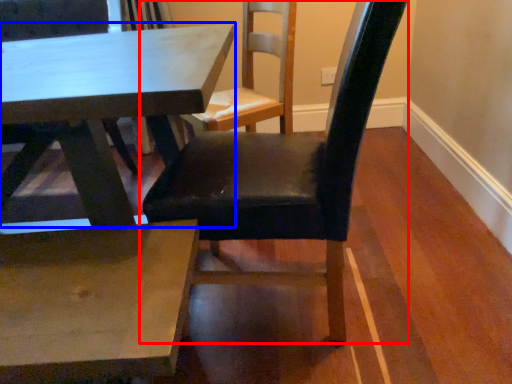
Question: Which point is further to the camera, chair (highlighted by a red box) or table (highlighted by a blue box)?

Choices:
 (A) chair
 (B) table

Answer: (B)